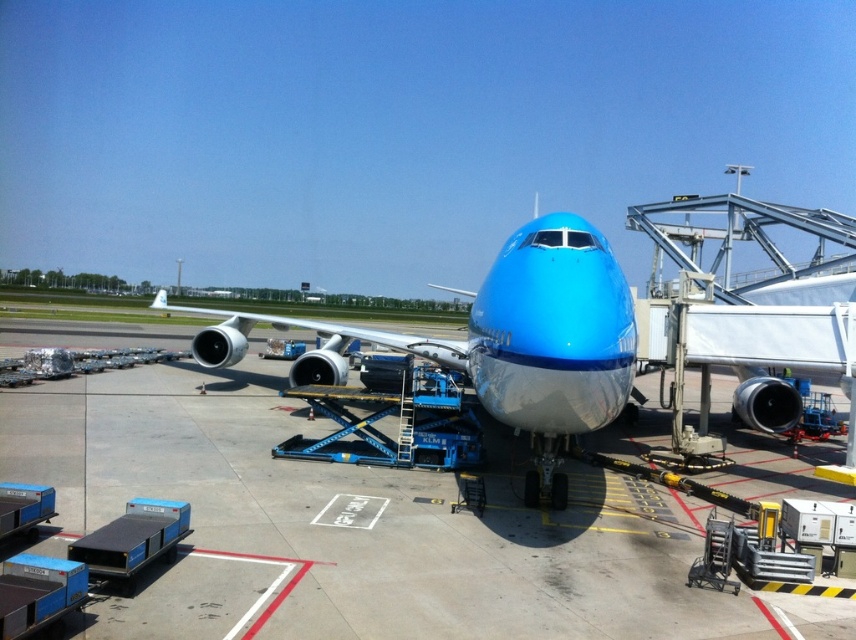
Does matte gray tarmac at center have a lesser height compared to matte blue airplane at center?

Correct, matte gray tarmac at center is not as tall as matte blue airplane at center.

Is point (155, 465) positioned after point (553, 396)?

Yes.

Identify the location of matte gray tarmac at center. The width and height of the screenshot is (856, 640). (363, 528).